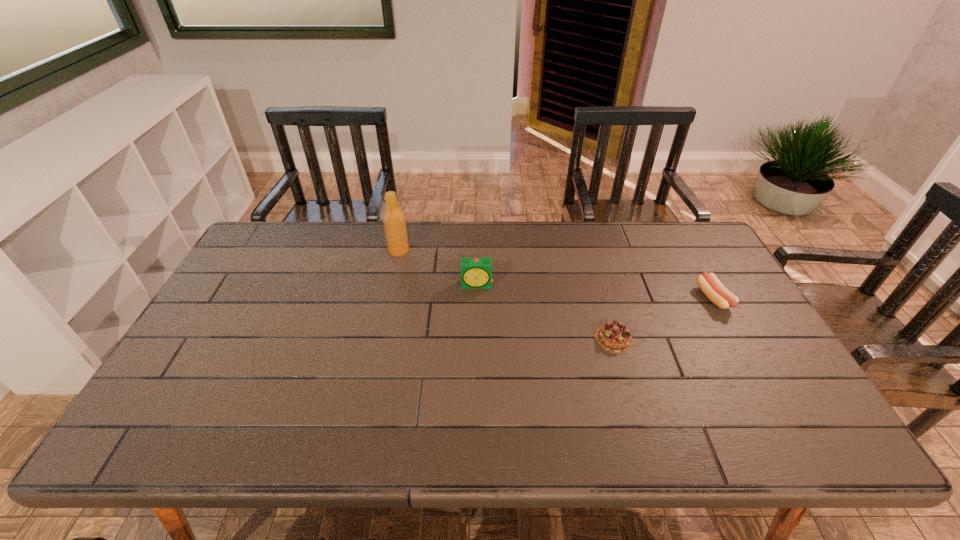
At what (x,y) coordinates should I click in order to perform the action: click on free area in between the leftmost object and the rightmost object. Please return your answer as a coordinate pair (x, y). The height and width of the screenshot is (540, 960). Looking at the image, I should click on (557, 274).

You are a GUI agent. You are given a task and a screenshot of the screen. Output one action in this format:
    pyautogui.click(x=<x>, y=<y>)
    Task: Click on the free space that is in between the rightmost object and the third object from right to left
    The height and width of the screenshot is (540, 960).
    Given the screenshot: What is the action you would take?
    pyautogui.click(x=595, y=292)

Find the location of a particular element. free space between the tallest object and the rightmost object is located at coordinates (557, 274).

Identify the location of free point between the leftmost object and the second object from left to right. (438, 268).

Locate an element on the screen. empty location between the alarm clock and the third object from left to right is located at coordinates (545, 312).

Locate an element on the screen. unoccupied position between the rightmost object and the farthest object is located at coordinates (557, 274).

This screenshot has height=540, width=960. I want to click on empty space between the alarm clock and the leftmost object, so click(438, 268).

Identify the location of free space between the second object from left to right and the rightmost object. (595, 292).

I want to click on free space between the sausage and the tallest object, so click(557, 274).

Find the location of a particular element. The width and height of the screenshot is (960, 540). vacant point located between the beer bottle and the chocolate cake is located at coordinates point(506,295).